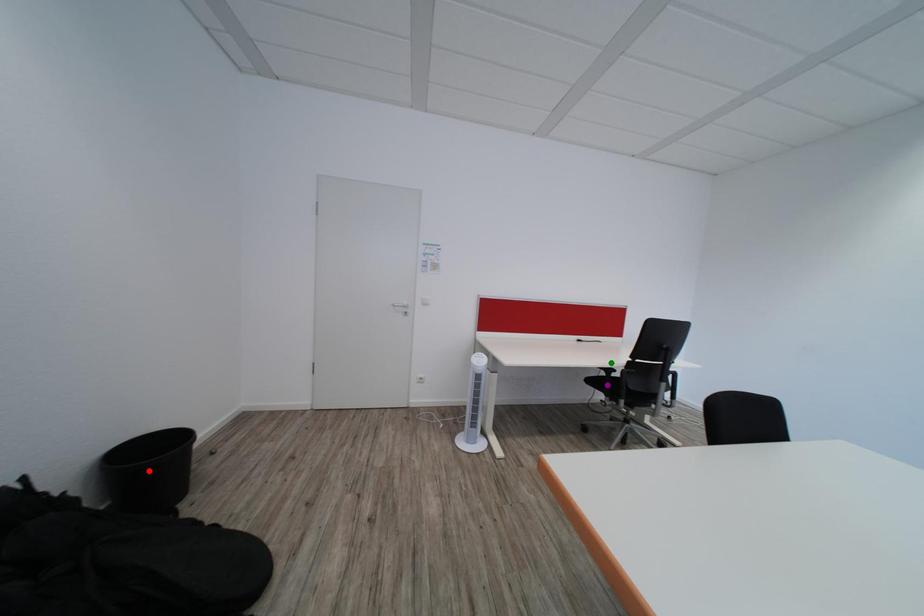
Order these from nearest to farthest:
green point, red point, purple point

red point → purple point → green point